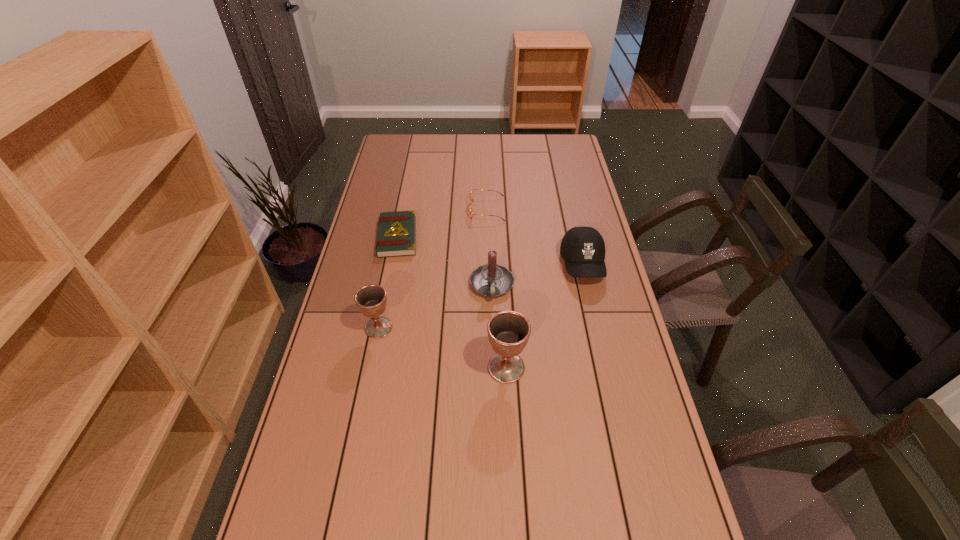
Locate an element on the screen. The height and width of the screenshot is (540, 960). vacant area situated on the back of the nearer chalice is located at coordinates (504, 327).

The width and height of the screenshot is (960, 540). Find the location of `free spot located 0.140m on the front-facing side of the spectacles`. free spot located 0.140m on the front-facing side of the spectacles is located at coordinates (435, 210).

Where is `vacant region located on the front-facing side of the spectacles`? vacant region located on the front-facing side of the spectacles is located at coordinates (447, 210).

This screenshot has height=540, width=960. I want to click on vacant region located 0.360m on the front-facing side of the spectacles, so (380, 210).

Locate an element on the screen. vacant region located on the front-facing side of the baseball cap is located at coordinates (607, 370).

What are the coordinates of `vacant space located on the back of the book` in the screenshot? It's located at (407, 188).

Where is `free spot located 0.400m on the side of the candle with the handle loop`? The width and height of the screenshot is (960, 540). free spot located 0.400m on the side of the candle with the handle loop is located at coordinates (495, 421).

This screenshot has width=960, height=540. I want to click on chalice that is at the left edge, so click(x=371, y=300).

In order to click on book at the left edge in this screenshot , I will do `click(397, 230)`.

Image resolution: width=960 pixels, height=540 pixels. In order to click on object located in the right edge section of the desktop in this screenshot , I will do click(x=583, y=249).